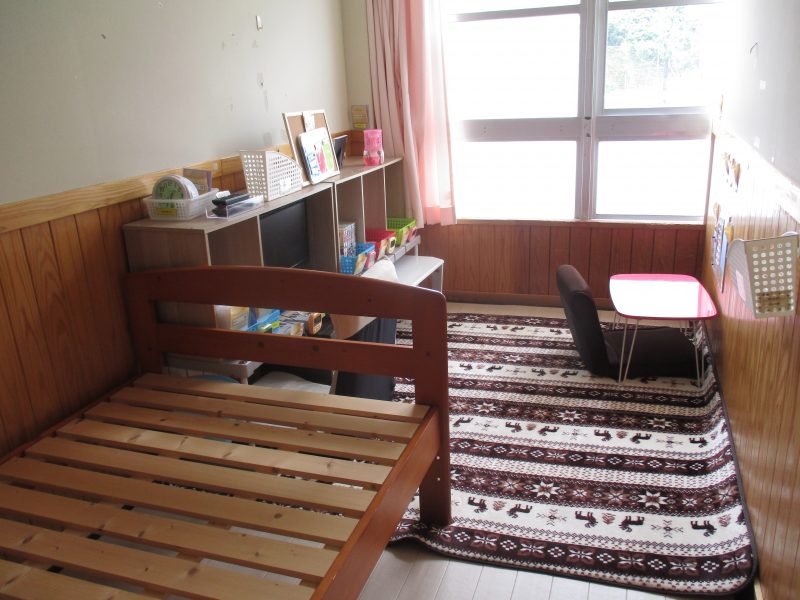
Locate an element on the screen. Image resolution: width=800 pixels, height=600 pixels. bed frame is located at coordinates (384, 516).